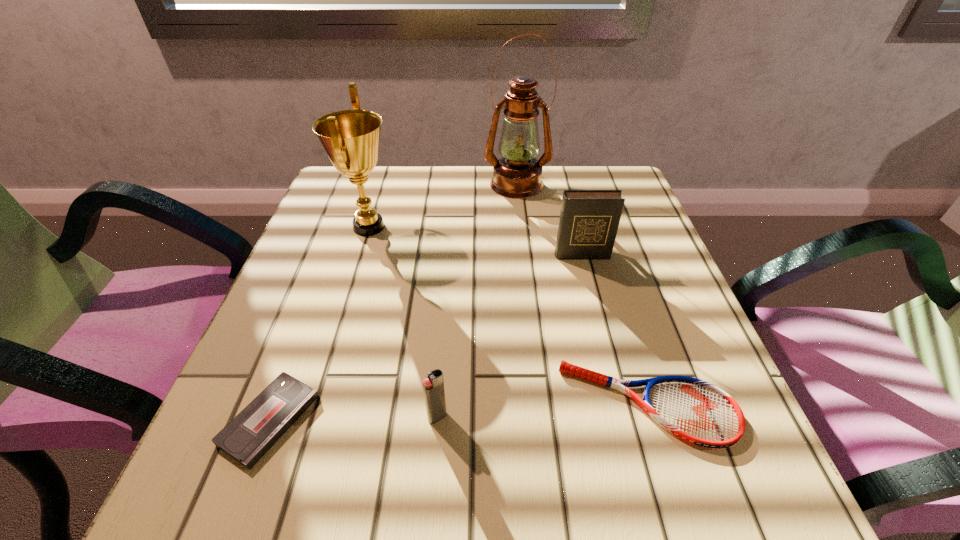
In order to click on blank space at the far right corner in this screenshot , I will do `click(583, 178)`.

Locate an element on the screen. This screenshot has height=540, width=960. blank space at the near right corner of the desktop is located at coordinates (759, 469).

Where is `vacant area that lies between the tennis racket and the fourth object from right to left`? Image resolution: width=960 pixels, height=540 pixels. vacant area that lies between the tennis racket and the fourth object from right to left is located at coordinates (542, 410).

The height and width of the screenshot is (540, 960). Find the location of `vacant space that's between the videotape and the diary`. vacant space that's between the videotape and the diary is located at coordinates (425, 338).

Where is `vacant point located between the fourth shortest object and the videotape`? vacant point located between the fourth shortest object and the videotape is located at coordinates (425, 338).

I want to click on free point between the tennis racket and the videotape, so click(459, 412).

Locate an element on the screen. The height and width of the screenshot is (540, 960). vacant space that is in between the tennis racket and the farthest object is located at coordinates (583, 294).

Identify the location of vacant region between the tallest object and the third object from left to right. The height and width of the screenshot is (540, 960). (477, 301).

Where is `free spot between the fourth object from right to left and the videotape`? This screenshot has width=960, height=540. free spot between the fourth object from right to left and the videotape is located at coordinates (353, 418).

Locate an element on the screen. free space between the igniter and the second tallest object is located at coordinates (403, 322).